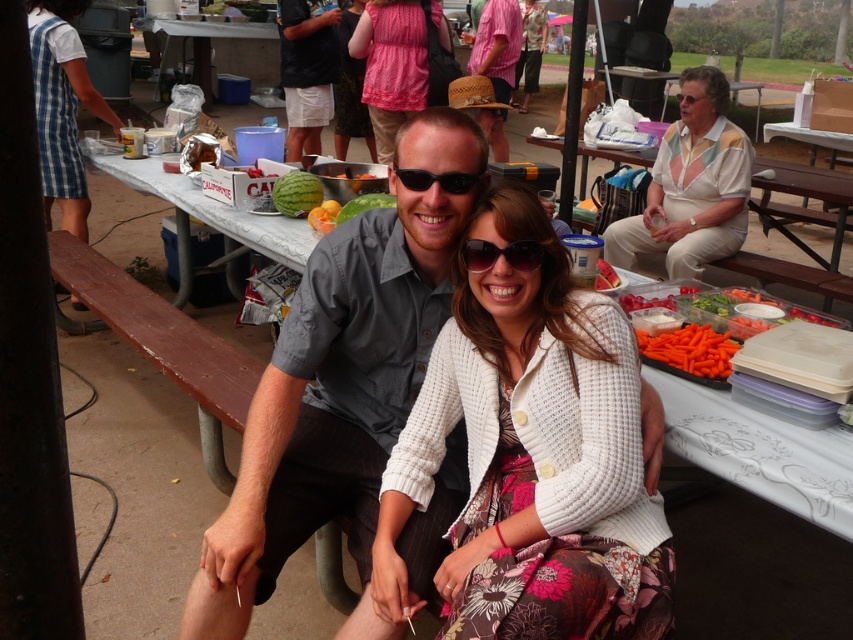
Between white knitted cardigan at center and clear plastic goggles at upper center, which one appears on the left side from the viewer's perspective?

From the viewer's perspective, white knitted cardigan at center appears more on the left side.

Is white knitted cardigan at center thinner than clear plastic goggles at upper center?

Yes.

At what (x,y) coordinates should I click in order to perform the action: click on white knitted cardigan at center. Please return your answer as a coordinate pair (x, y). This screenshot has width=853, height=640. Looking at the image, I should click on (532, 456).

Between point (309, 307) and point (469, 269), which one is positioned behind?

The point (309, 307) is behind.

Is gray cotton shirt at center above sunglasses at center?

No, gray cotton shirt at center is not above sunglasses at center.

Describe the element at coordinates (331, 400) in the screenshot. The width and height of the screenshot is (853, 640). I see `gray cotton shirt at center` at that location.

You are a GUI agent. You are given a task and a screenshot of the screen. Output one action in this format:
    pyautogui.click(x=<x>, y=<y>)
    Task: Click on the gray cotton shirt at center
    This screenshot has width=853, height=640.
    Given the screenshot: What is the action you would take?
    pyautogui.click(x=331, y=400)

Between point (683, 124) and point (459, 180), which one is positioned in front?

Positioned in front is point (459, 180).

Which is above, white textured blouse at upper right or black plastic sunglasses at center?

white textured blouse at upper right is above.

The image size is (853, 640). I want to click on white textured blouse at upper right, so click(691, 186).